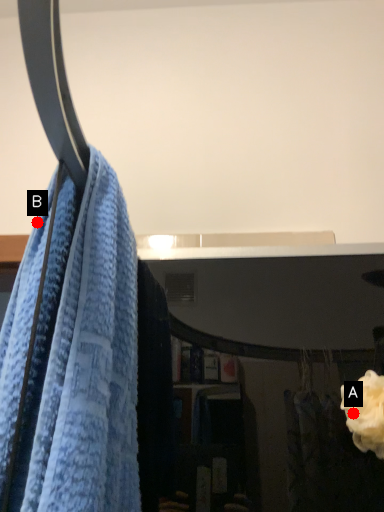
Question: Two points are circled on the image, labeled by A and B beside each circle. Which point is closer to the camera?

Choices:
 (A) A is closer
 (B) B is closer

Answer: (B)